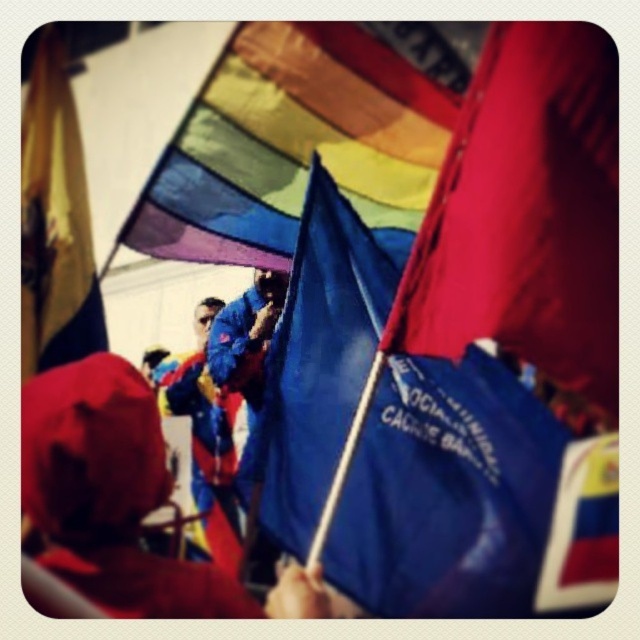
Question: Is rainbow fabric flag at upper center wider than red fabric hat at lower left?

Choices:
 (A) yes
 (B) no

Answer: (B)

Question: Which of the following is the farthest from the observer?

Choices:
 (A) polished plastic flag at lower right
 (B) yellow fabric flag at left
 (C) rainbow fabric flag at upper center
 (D) red fabric hat at lower left

Answer: (B)

Question: Does rainbow fabric flag at upper center appear on the right side of yellow fabric flag at left?

Choices:
 (A) yes
 (B) no

Answer: (A)

Question: Which of the following is the closest to the observer?

Choices:
 (A) click(x=465, y=161)
 (B) click(x=264, y=376)

Answer: (A)

Question: Among these objects, which one is nearest to the camera?

Choices:
 (A) blue fabric flag at center
 (B) yellow fabric flag at left
 (C) rainbow fabric flag at upper center
 (D) red fabric hat at lower left

Answer: (D)

Question: Does red fabric hat at lower left have a greater width compared to yellow fabric flag at left?

Choices:
 (A) yes
 (B) no

Answer: (A)